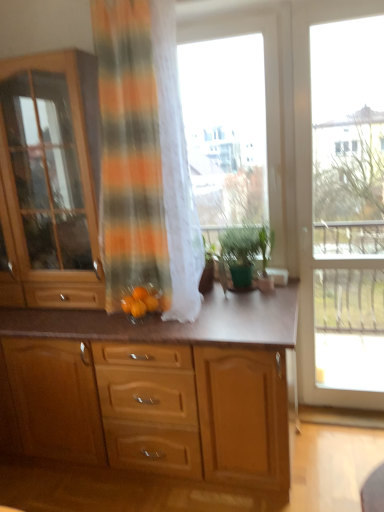
Where is `vacant area that is in front of green matte plant at center`? This screenshot has width=384, height=512. vacant area that is in front of green matte plant at center is located at coordinates coord(251,303).